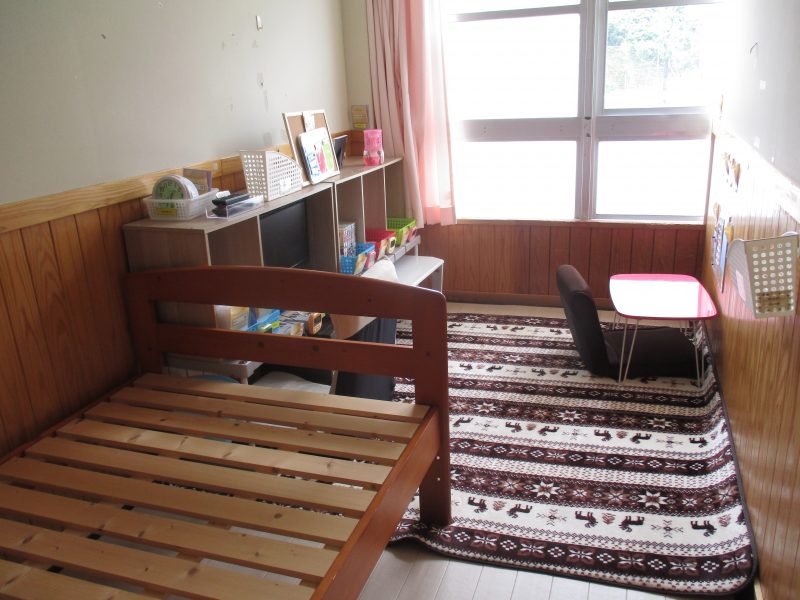
This screenshot has height=600, width=800. I want to click on bed slats, so click(64, 589), click(116, 564), click(172, 536), click(209, 508), click(245, 480), click(282, 458), click(325, 440), click(354, 423), click(386, 408).